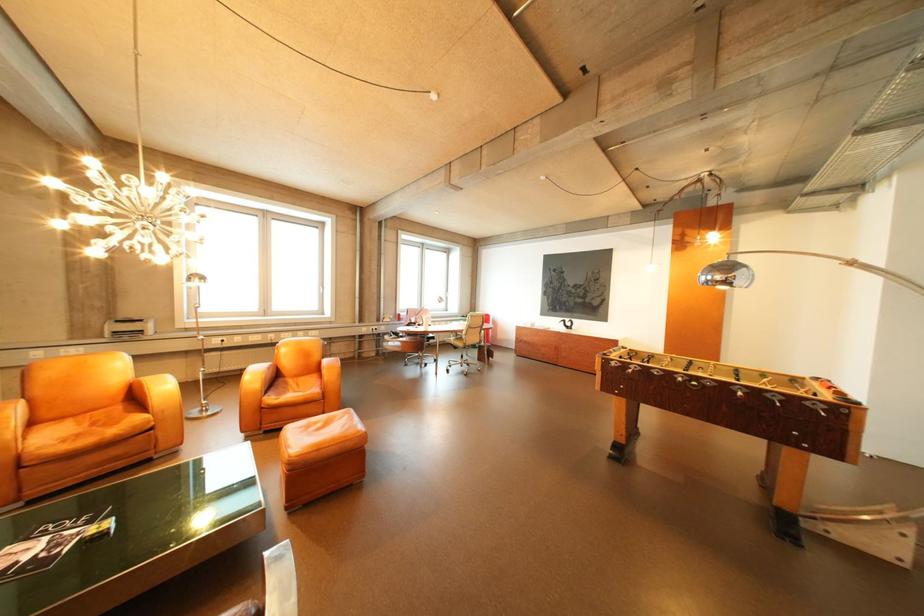
Describe the element at coordinates (322, 432) in the screenshot. The height and width of the screenshot is (616, 924). I see `the orange leather ottoman` at that location.